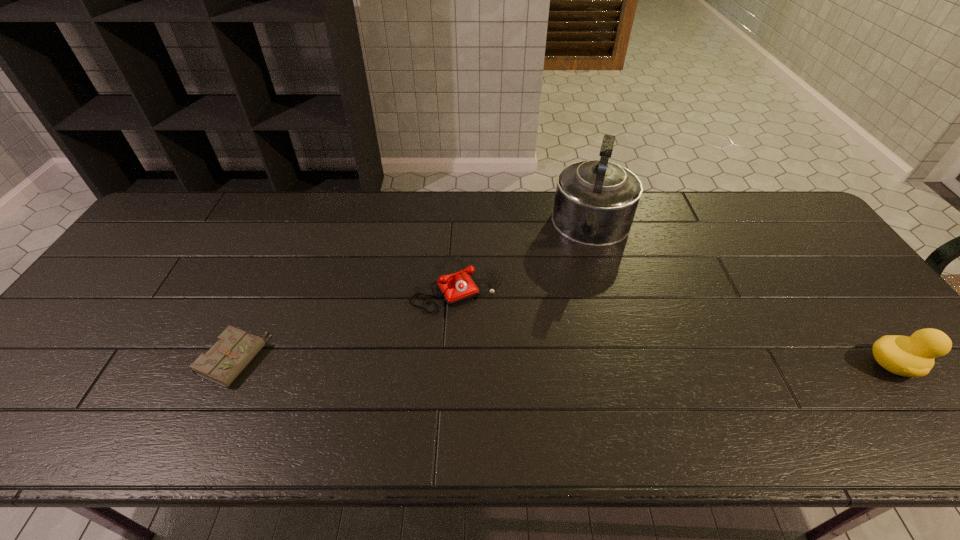
You are a GUI agent. You are given a task and a screenshot of the screen. Output one action in this format:
    pyautogui.click(x=<x>, y=<y>)
    Task: Click on the vacant space that satisfies the following two spatial constraints: 1. on the front side of the diary; 2. on the front-facing side of the rightmost object
    This screenshot has height=540, width=960.
    Given the screenshot: What is the action you would take?
    pyautogui.click(x=230, y=365)

Locate an element on the screen. vacant point that satisfies the following two spatial constraints: 1. on the front side of the diary; 2. on the front-facing side of the duck is located at coordinates (230, 365).